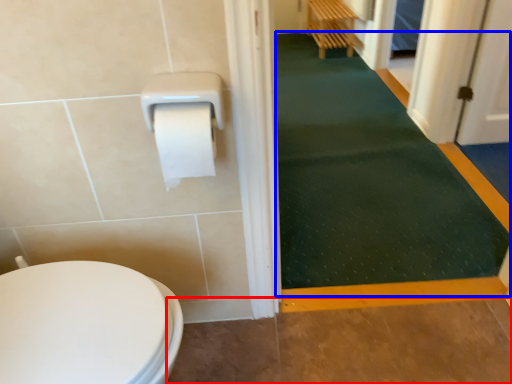
Question: Which of the following is the farthest to the observer, path (highlighted by a red box) or bath mat (highlighted by a blue box)?

Choices:
 (A) path
 (B) bath mat

Answer: (B)